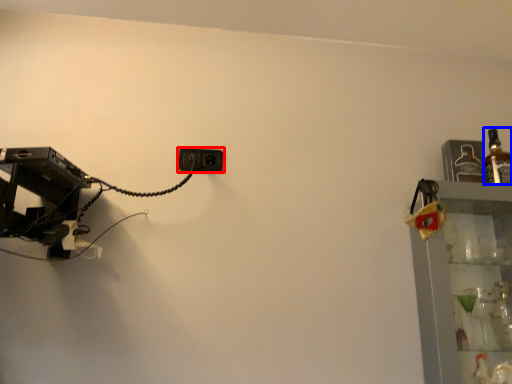
Question: Which object appears farthest to the camera in this image, power plugs and sockets (highlighted by a red box) or bottle (highlighted by a blue box)?

Choices:
 (A) power plugs and sockets
 (B) bottle

Answer: (A)